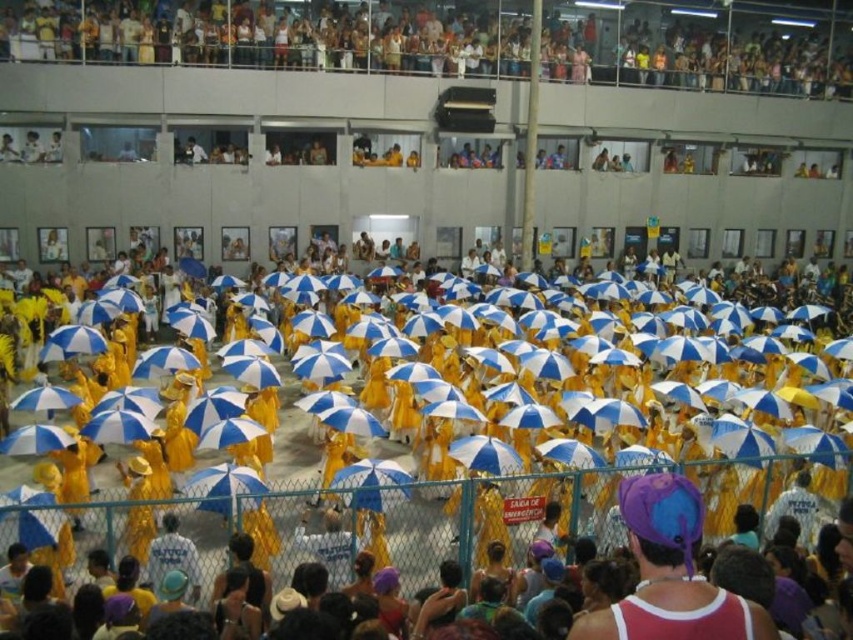
You are a photographer standing at the back of the stadium trying to capture both the yellow fabric umbrellas at upper center and the purple fabric hat at center in a single photo. Given that your camera has a maximum focal length that allows capturing objects within a 150 feet distance, will you be able to include both subjects in your shot?

The yellow fabric umbrellas at upper center and purple fabric hat at center are 146.10 feet apart from each other. Since the distance between them is less than the camera maximum focal length of 150 feet, you can include both subjects in a single photo.

You are a photographer positioned at the origin point of the coordinate system. You want to capture a photo of the yellow fabric umbrellas at upper center. What are their exact coordinates in the image?

The yellow fabric umbrellas at upper center are located at coordinates point (267, 35).

From the picture: You are a photographer positioned in the front row of the stadium venue. You want to capture a photo that includes both the yellow fabric umbrellas at upper center and the purple fabric hat at center. Which object should you focus on first to ensure both are in frame?

You should focus on the yellow fabric umbrellas at upper center first since they are closer to you than the purple fabric hat at center, ensuring both will be in frame when properly focused.